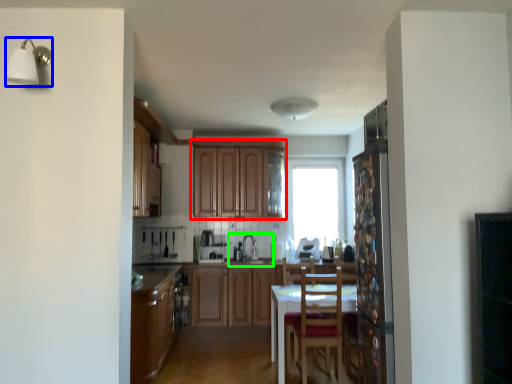
Question: Based on their relative distances, which object is farther from cabinetry (highlighted by a red box)? Choose from light fixture (highlighted by a blue box) and sink (highlighted by a green box).

Choices:
 (A) light fixture
 (B) sink

Answer: (A)